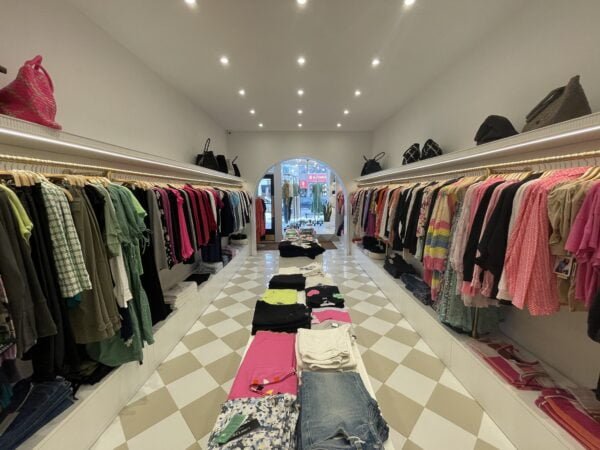
The height and width of the screenshot is (450, 600). In order to click on shelf to display manequins in this screenshot , I will do `click(327, 232)`.